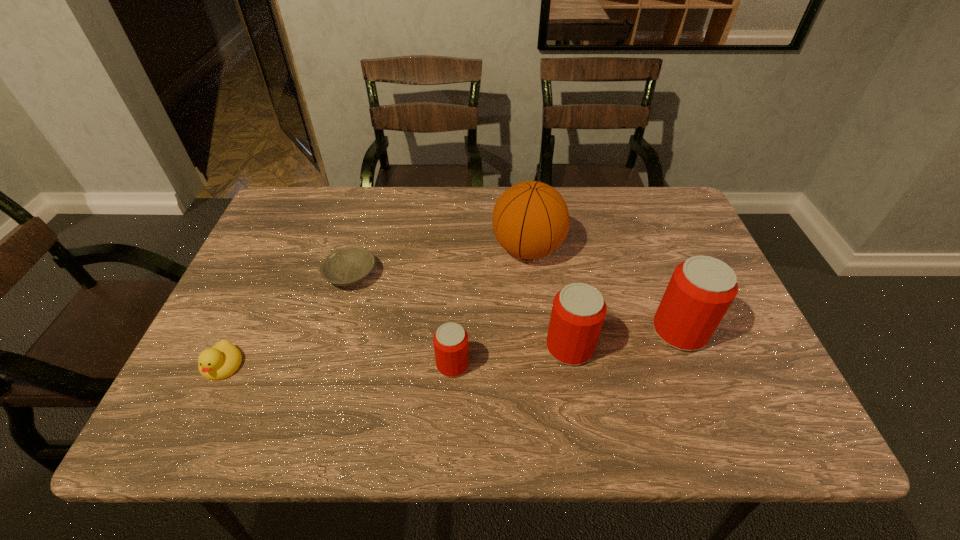
This screenshot has height=540, width=960. What are the coordinates of `blank area in the image that satisfies the following two spatial constraints: 1. on the back side of the third object from left to right; 2. on the right side of the basketball` in the screenshot? It's located at (459, 249).